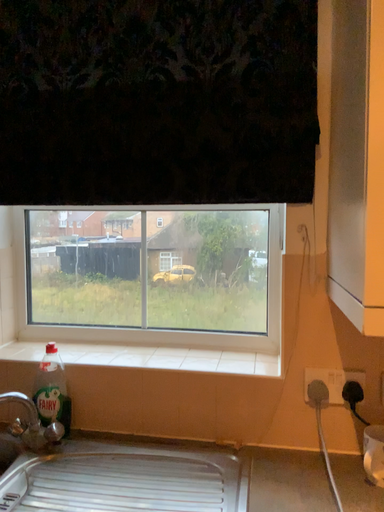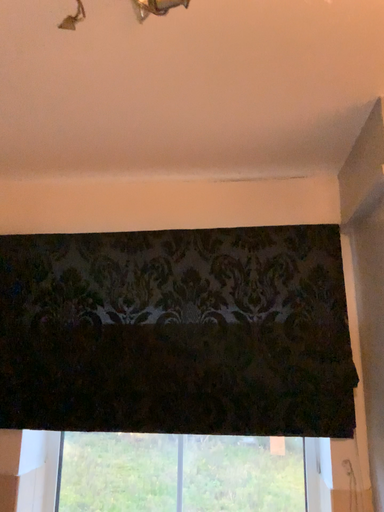
Question: Which way did the camera rotate in the video?

Choices:
 (A) rotated upward
 (B) rotated downward

Answer: (A)